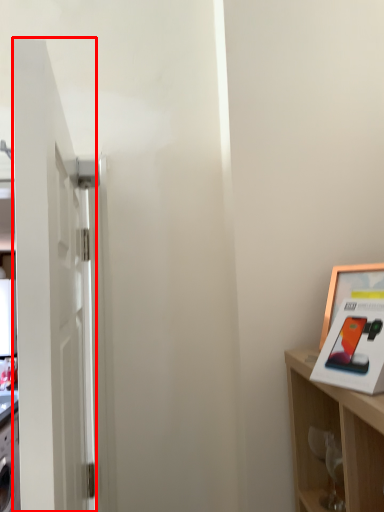
Question: In this image, where is door (annotated by the red box) located relative to picture frame?

Choices:
 (A) left
 (B) right

Answer: (A)